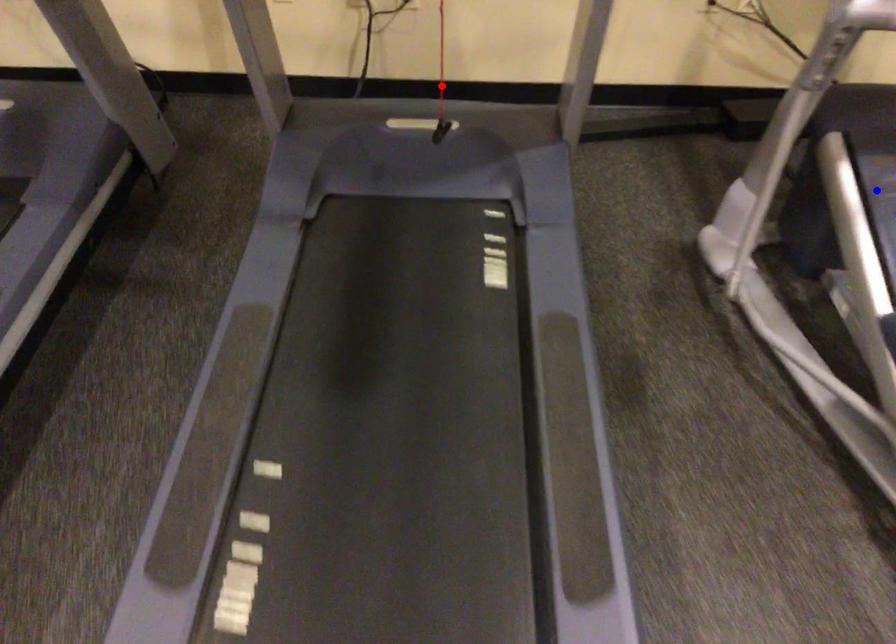
Question: In the image, two points are highlighted. Which point is nearer to the camera? Reply with the corresponding letter.

Choices:
 (A) blue point
 (B) red point

Answer: (A)